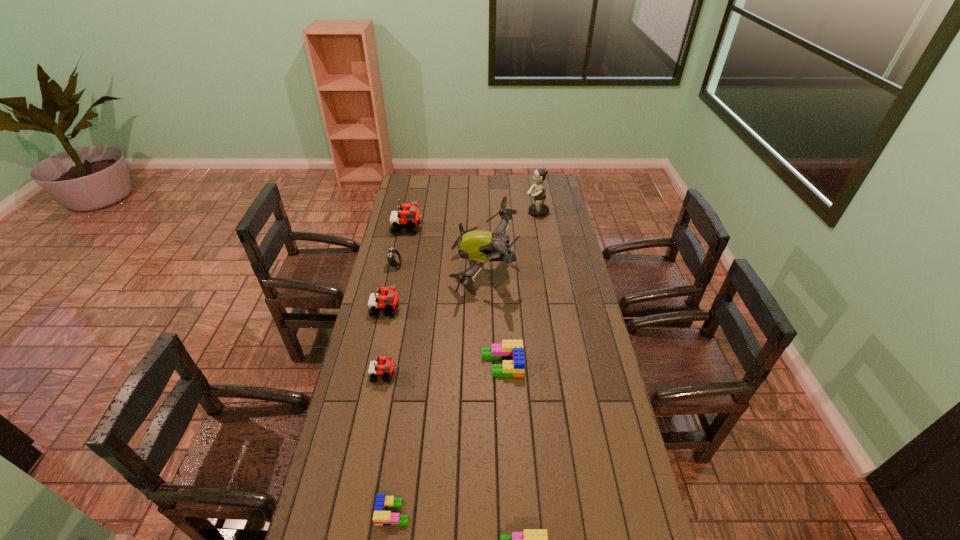
This screenshot has width=960, height=540. I want to click on vacant space located on the front-facing side of the second farthest object, so click(481, 228).

What are the coordinates of `blank space located 0.120m on the front-facing side of the second biggest red Lego` in the screenshot? It's located at (430, 310).

Locate an element on the screen. This screenshot has width=960, height=540. free point located on the face of the white alarm clock is located at coordinates (428, 265).

Find the location of a particular element. Image resolution: width=960 pixels, height=540 pixels. vacant space situated on the front-facing side of the fourth shortest Lego is located at coordinates (467, 375).

This screenshot has height=540, width=960. In order to click on vacant space located 0.300m on the right of the farthest green Lego in this screenshot , I will do `click(605, 364)`.

This screenshot has width=960, height=540. What are the coordinates of `vacant region located 0.100m on the back of the smallest green Lego` in the screenshot? It's located at (399, 465).

Image resolution: width=960 pixels, height=540 pixels. In order to click on alarm clock situated at the left edge in this screenshot , I will do `click(394, 258)`.

At what (x,y) coordinates should I click in order to perform the action: click on object at the right edge. Please return your answer as a coordinate pair (x, y). The image size is (960, 540). Looking at the image, I should click on (539, 209).

Find the location of a particular element. The width and height of the screenshot is (960, 540). free space at the far edge is located at coordinates (494, 179).

Where is `vacant space at the left edge of the desktop`? This screenshot has height=540, width=960. vacant space at the left edge of the desktop is located at coordinates (424, 206).